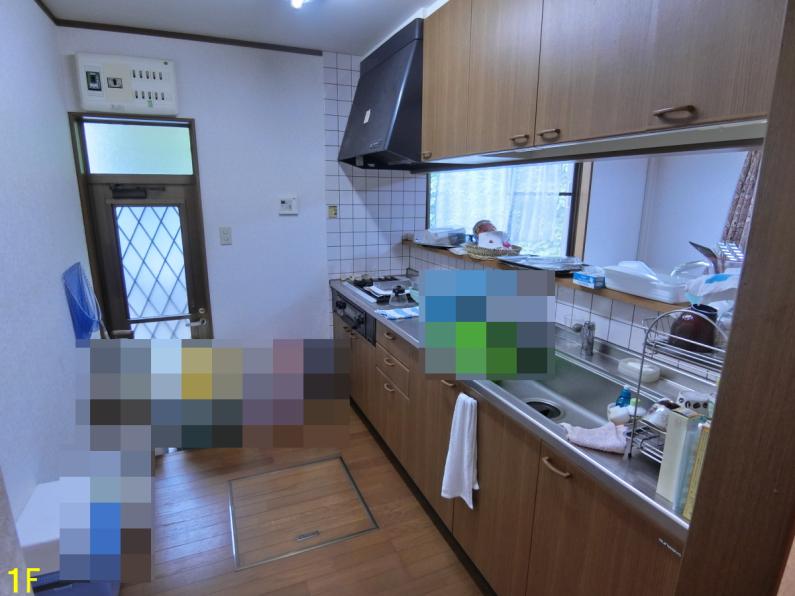
The height and width of the screenshot is (596, 795). Identify the location of sink. (572, 415).